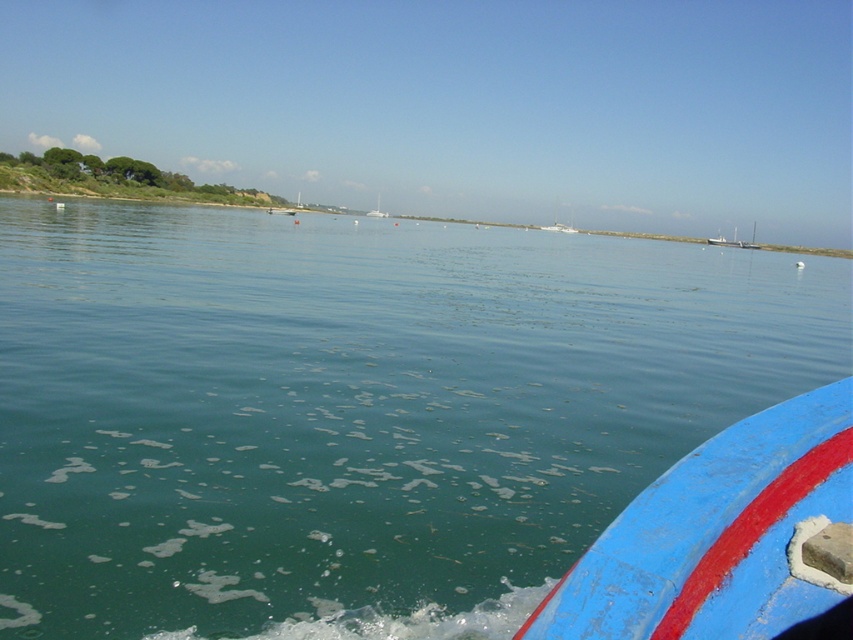
Question: Which of the following is the farthest from the observer?

Choices:
 (A) (788, 330)
 (B) (816, 445)
 (C) (752, 236)

Answer: (C)

Question: Estimate the real-world distances between objects in this image. Which object is closer to the blue painted wood boat at lower right?

Choices:
 (A) green matte water at center
 (B) white glossy sailboat at center

Answer: (A)

Question: Does white plastic boat at center appear on the right side of white glossy sailboat at center?

Choices:
 (A) no
 (B) yes

Answer: (B)

Question: Considering the real-world distances, which object is closest to the blue painted wood boat at lower right?

Choices:
 (A) green matte water at center
 (B) white plastic boat at center
 (C) white glossy sailboat at center

Answer: (A)

Question: Is blue painted wood boat at lower right behind white glossy sailboat at center?

Choices:
 (A) yes
 (B) no

Answer: (B)

Question: Can you confirm if green matte water at center is bigger than blue painted wood boat at lower right?

Choices:
 (A) no
 (B) yes

Answer: (B)